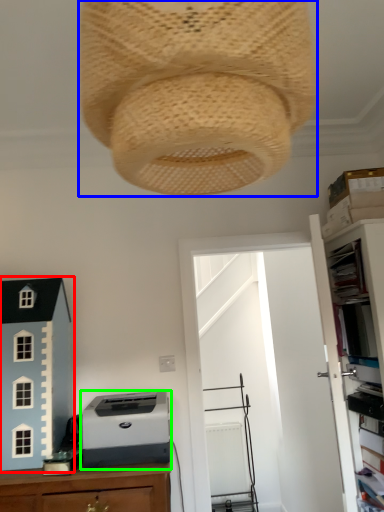
Question: Which is nearer to the toy (highlighted by a red box)? lamp (highlighted by a blue box) or printer (highlighted by a green box).

Choices:
 (A) lamp
 (B) printer

Answer: (B)